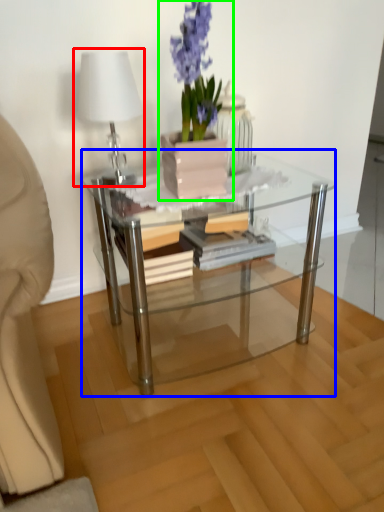
Question: Which is farther away from table lamp (highlighted by a red box)? coffee table (highlighted by a blue box) or houseplant (highlighted by a green box)?

Choices:
 (A) coffee table
 (B) houseplant

Answer: (A)